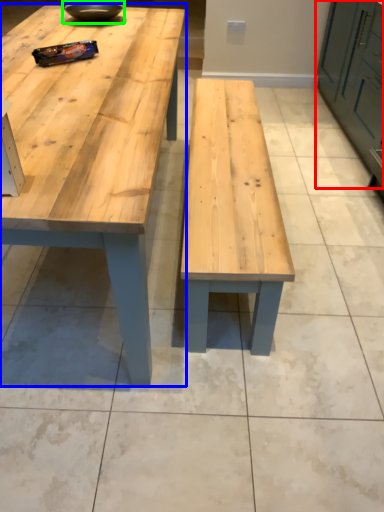
Question: Which is farther away from cabinetry (highlighted by a red box)? table (highlighted by a blue box) or bowl (highlighted by a green box)?

Choices:
 (A) table
 (B) bowl

Answer: (B)